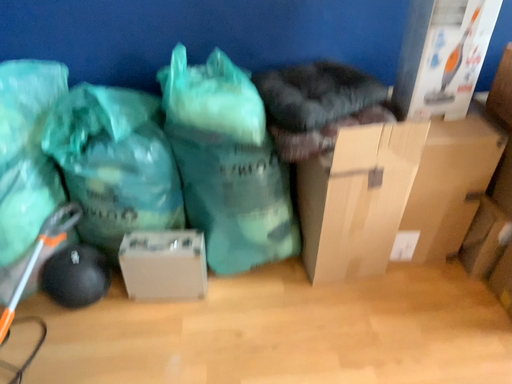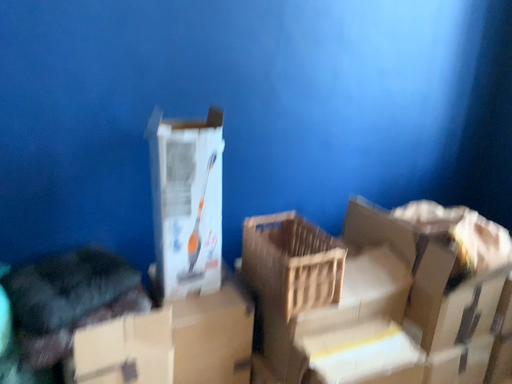
Question: Which way did the camera rotate in the video?

Choices:
 (A) rotated upward
 (B) rotated downward

Answer: (A)